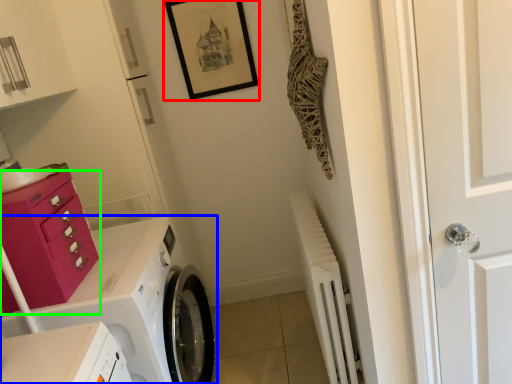
Question: Based on their relative distances, which object is nearer to picture frame (highlighted by a red box)? Choose from washing machine (highlighted by a blue box) and drawer (highlighted by a green box).

Choices:
 (A) washing machine
 (B) drawer

Answer: (A)